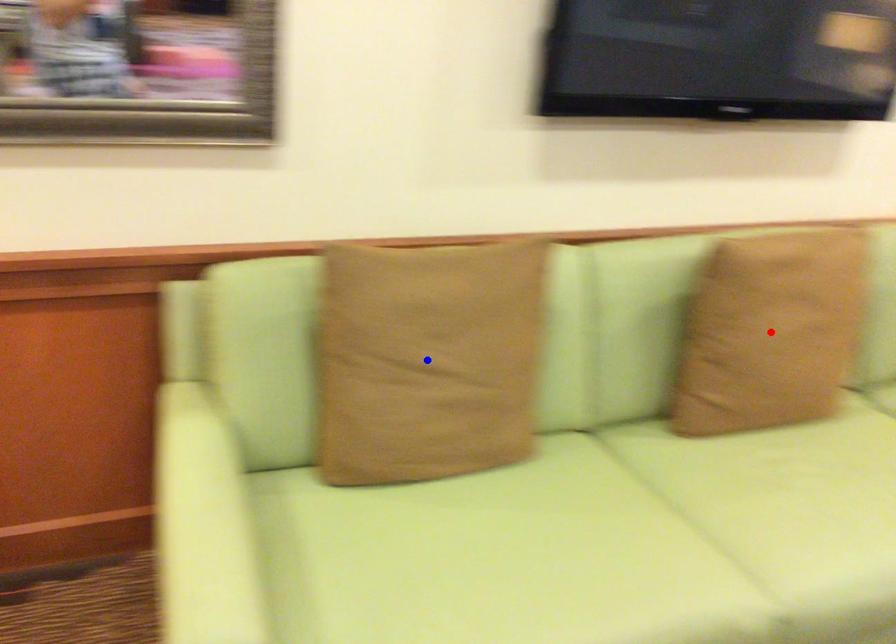
Question: Two points are marked on the image. Which point is closer to the camera?

Choices:
 (A) Blue point is closer.
 (B) Red point is closer.

Answer: (A)